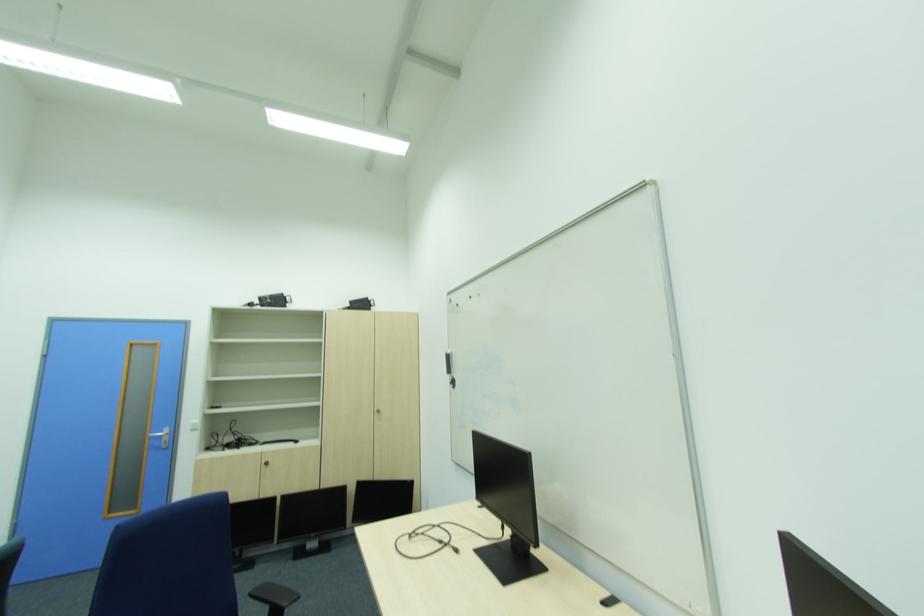
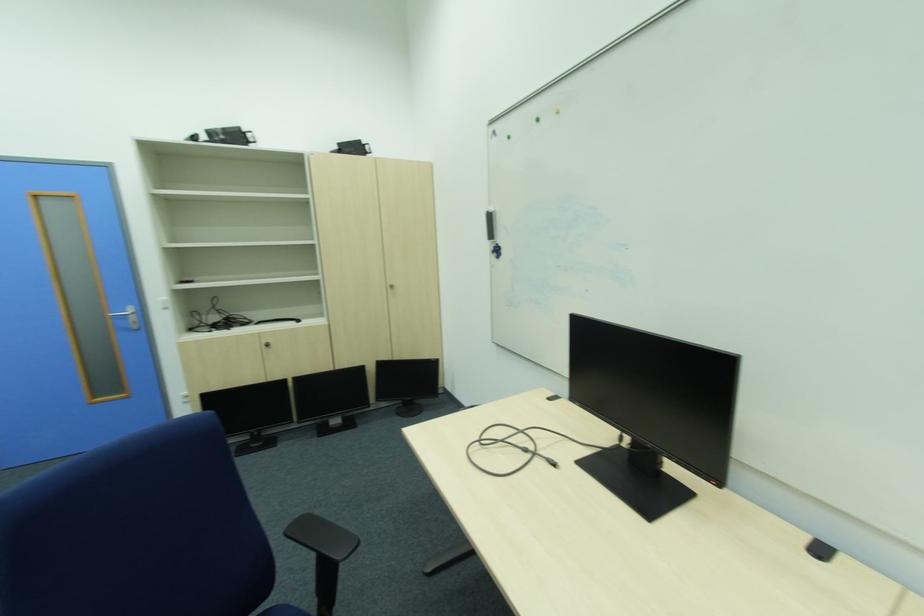
In a continuous first-person perspective shot, in which direction is the camera moving?

The cameraman walked toward left, forward.